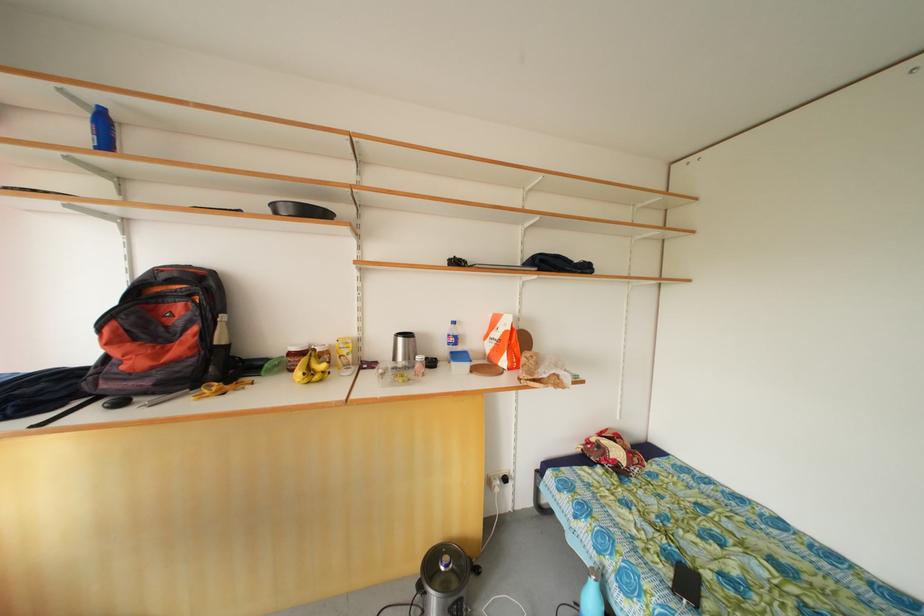
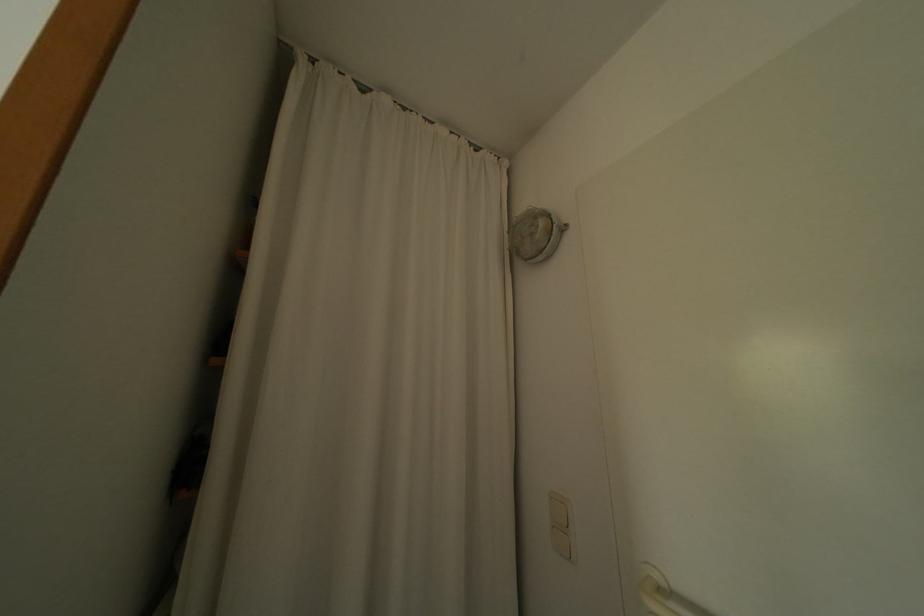
Question: The images are taken continuously from a first-person perspective. In which direction are you moving?

Choices:
 (A) Left
 (B) Right
 (C) Forward
 (D) Backward

Answer: (B)